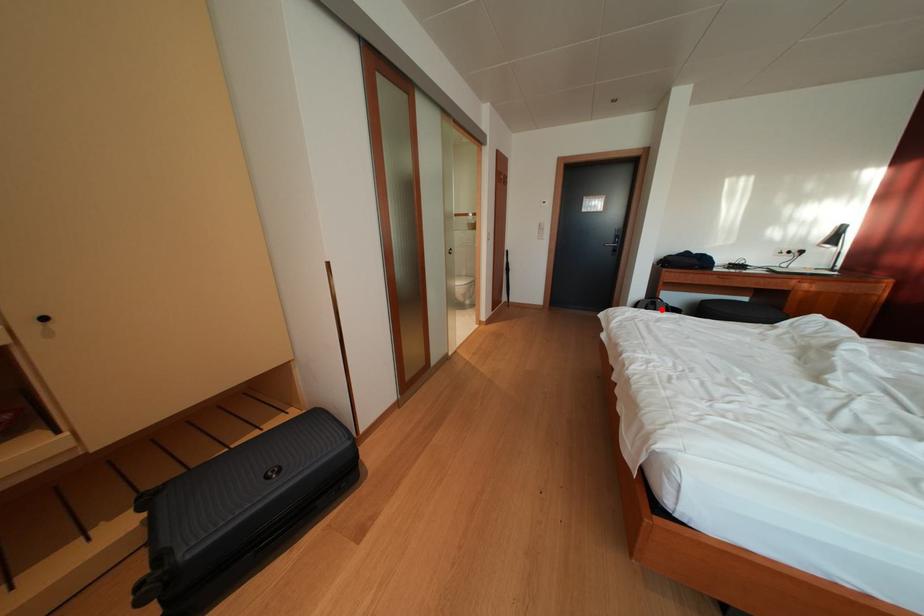
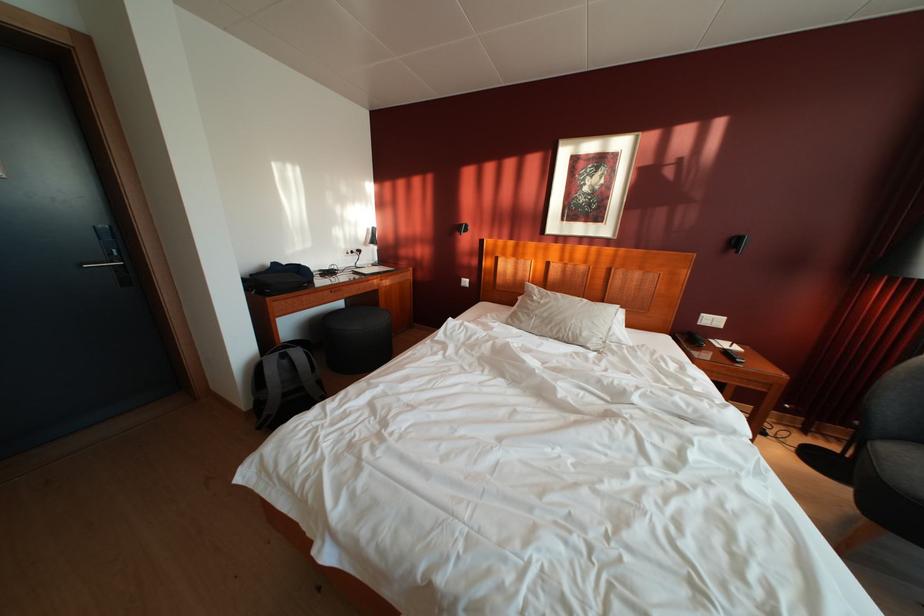
Locate, in the second image, the point that corresponds to the highlighted location in the first image.

(293, 362)